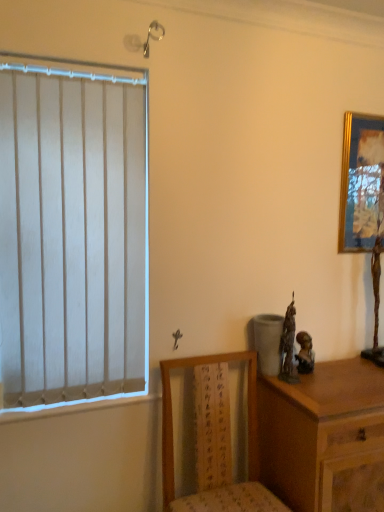
Question: In the image, is matte bronze statue at right positioned in front of or behind wooden chest of drawers at right?

Choices:
 (A) front
 (B) behind

Answer: (B)

Question: Looking at the image, does matte bronze statue at right seem bigger or smaller compared to wooden chest of drawers at right?

Choices:
 (A) small
 (B) big

Answer: (A)

Question: Which object is the closest to the gold-framed picture at upper right?

Choices:
 (A) wooden chest of drawers at right
 (B) matte bronze statue at right
 (C) wooden chair at lower center

Answer: (B)

Question: Estimate the real-world distances between objects in this image. Which object is farther from the wooden chair at lower center?

Choices:
 (A) gold-framed picture at upper right
 (B) matte bronze statue at right
 (C) wooden chest of drawers at right

Answer: (A)